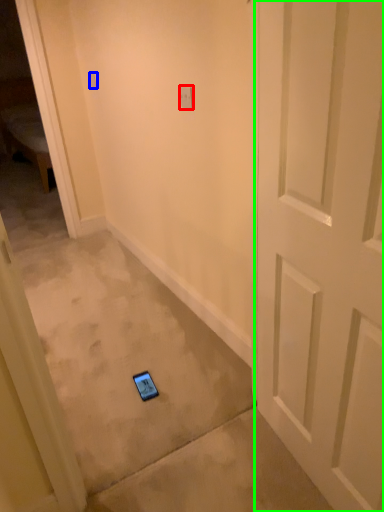
Question: Considering the real-world distances, which object is farthest from light switch (highlighted by a red box)? light switch (highlighted by a blue box) or door (highlighted by a green box)?

Choices:
 (A) light switch
 (B) door

Answer: (A)